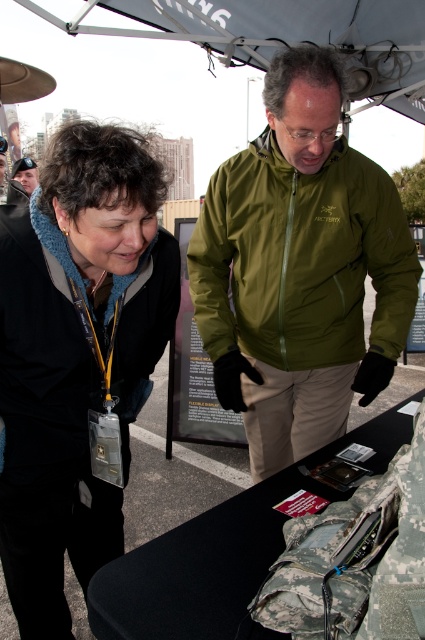
Question: Does olive green jacket at center have a smaller size compared to black fleece jacket at upper left?

Choices:
 (A) yes
 (B) no

Answer: (B)

Question: Among these objects, which one is farthest from the camera?

Choices:
 (A) olive green jacket at center
 (B) matte black helmet at upper left
 (C) black fleece jacket at upper left

Answer: (B)

Question: Is olive green jacket at center behind matte black helmet at upper left?

Choices:
 (A) no
 (B) yes

Answer: (A)

Question: Does olive green jacket at center come behind matte black helmet at upper left?

Choices:
 (A) no
 (B) yes

Answer: (A)

Question: Which object appears farthest from the camera in this image?

Choices:
 (A) matte black helmet at upper left
 (B) black fleece jacket at upper left
 (C) olive green jacket at center

Answer: (A)

Question: Which of the following is the closest to the observer?

Choices:
 (A) (278, 264)
 (B) (70, 432)
 (C) (33, 163)

Answer: (B)